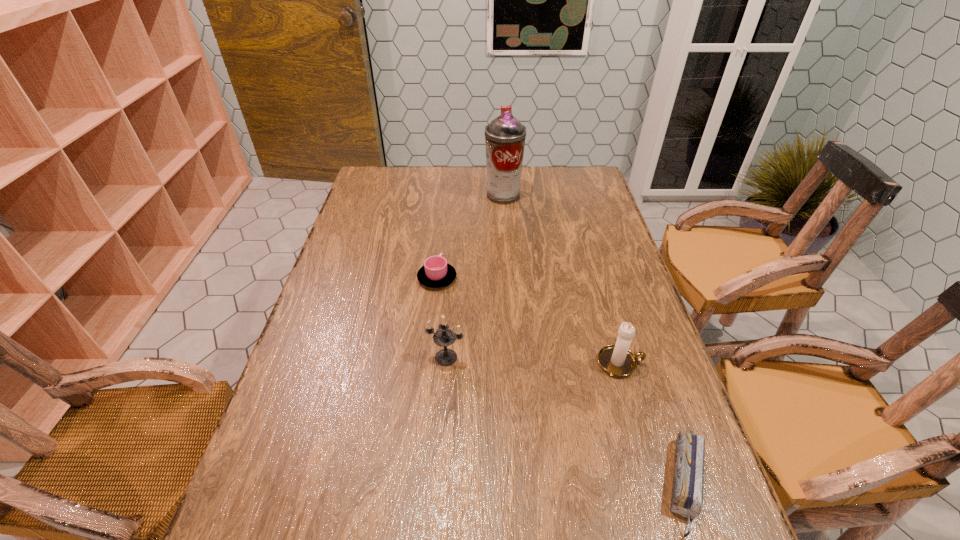
This screenshot has width=960, height=540. I want to click on object that is at the far edge, so click(x=505, y=136).

Identify the location of object located in the right edge section of the desktop. (617, 360).

In the image, there is a desktop. At what (x,y) coordinates should I click in order to perform the action: click on vacant region at the far edge. Please return your answer as a coordinate pair (x, y). The height and width of the screenshot is (540, 960). Looking at the image, I should click on (539, 196).

I want to click on free point at the left edge, so click(252, 505).

Find the location of a particular element. vacant space at the right edge of the desktop is located at coordinates (578, 203).

This screenshot has width=960, height=540. In order to click on free space between the left candle holder and the third object from right to left in this screenshot , I will do `click(474, 276)`.

The width and height of the screenshot is (960, 540). What are the coordinates of `vacant area that lies between the right candle holder and the fourth nearest object` in the screenshot? It's located at (529, 320).

Identify the location of vacant space in between the left candle holder and the right candle holder. (533, 360).

The image size is (960, 540). What are the coordinates of `free space between the second farthest object and the aerosol can` in the screenshot? It's located at coord(470,237).

Where is `vacant space that is in between the fourth nearest object and the right candle holder`? The image size is (960, 540). vacant space that is in between the fourth nearest object and the right candle holder is located at coordinates (529, 320).